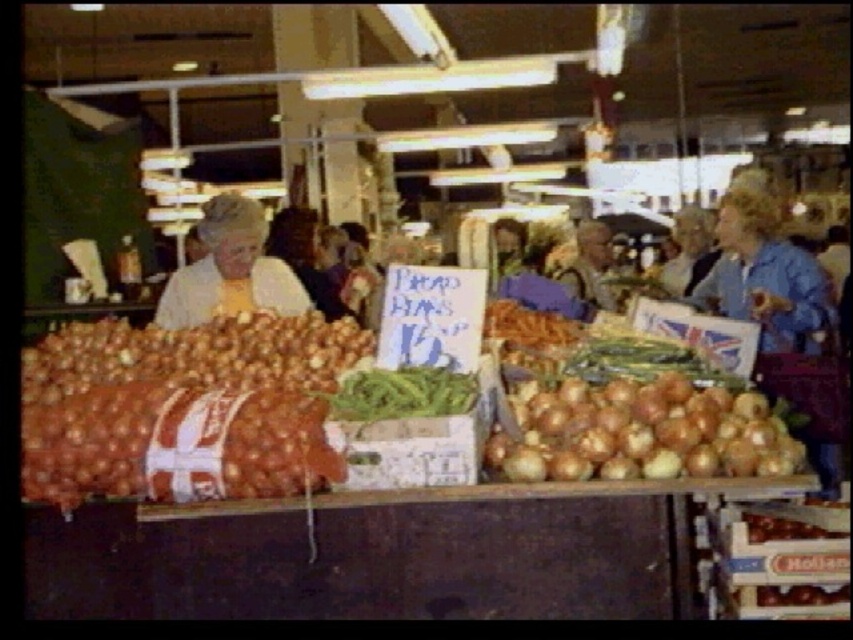
You are a customer at the market and want to buy the larger item between the smooth brown onion at center and the white fabric at center. Which one should you choose?

The smooth brown onion at center is larger in size than the white fabric at center, so you should choose the smooth brown onion at center.